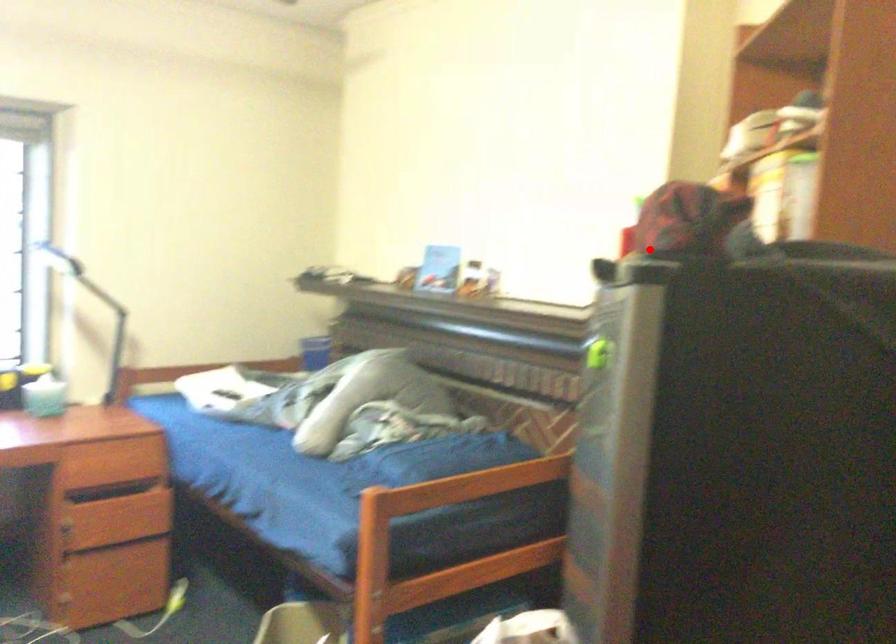
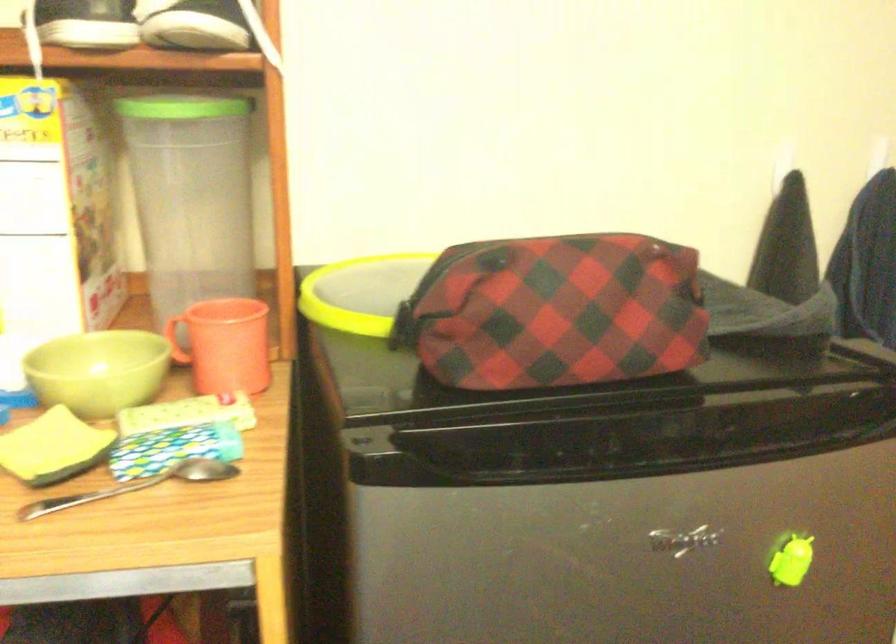
Locate, in the second image, the point that corresponds to the highlighted location in the first image.

(556, 430)